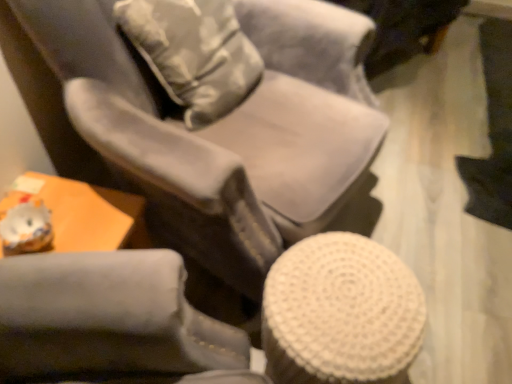
The width and height of the screenshot is (512, 384). What are the coordinates of `suede-like gray chair at center` in the screenshot? It's located at (220, 118).

What is the approximate height of white woven stool at lower right?

white woven stool at lower right is 16.64 inches in height.

In order to face camouflage fabric throw pillow at upper center, should I rotate leftwards or rightwards?

A 7.316 degree turn to the left will do.

This screenshot has height=384, width=512. In order to click on suede-like gray chair at center in this screenshot , I will do [220, 118].

Find the location of a particular element. This screenshot has height=384, width=512. bar stool below the suede-like gray chair at center (from a real-world perspective) is located at coordinates (341, 312).

Looking at this image, would you say white woven stool at lower right is part of suede-like gray chair at center's contents?

No, white woven stool at lower right is not surrounded by suede-like gray chair at center.

Is suede-like gray chair at center taller than white woven stool at lower right?

Indeed, suede-like gray chair at center has a greater height compared to white woven stool at lower right.

Is point (115, 103) positioned in front of point (366, 322)?

No, it is behind (366, 322).

Can you confirm if camouflage fabric throw pillow at upper center is smaller than suede-like gray chair at center?

Indeed, camouflage fabric throw pillow at upper center has a smaller size compared to suede-like gray chair at center.

Is camouflage fabric throw pillow at upper center beside suede-like gray chair at center?

No, camouflage fabric throw pillow at upper center is not next to suede-like gray chair at center.

From the image's perspective, is camouflage fabric throw pillow at upper center on top of suede-like gray chair at center?

Yes.

How different are the orientations of camouflage fabric throw pillow at upper center and suede-like gray chair at center in degrees?

camouflage fabric throw pillow at upper center and suede-like gray chair at center are facing 0.987 degrees away from each other.

Is camouflage fabric throw pillow at upper center spatially inside white woven stool at lower right, or outside of it?

The correct answer is: outside.

Does camouflage fabric throw pillow at upper center have a lesser height compared to white woven stool at lower right?

No.

Can you confirm if camouflage fabric throw pillow at upper center is thinner than white woven stool at lower right?

Correct, the width of camouflage fabric throw pillow at upper center is less than that of white woven stool at lower right.

Considering the relative positions of camouflage fabric throw pillow at upper center and white woven stool at lower right in the image provided, is camouflage fabric throw pillow at upper center to the left or to the right of white woven stool at lower right?

From the image, it's evident that camouflage fabric throw pillow at upper center is to the left of white woven stool at lower right.

Where is `chair lying above the white woven stool at lower right (from the image's perspective)`? chair lying above the white woven stool at lower right (from the image's perspective) is located at coordinates (220, 118).

Is white woven stool at lower right far away from suede-like gray chair at center?

No.

Is white woven stool at lower right taller than suede-like gray chair at center?

Incorrect, the height of white woven stool at lower right is not larger of that of suede-like gray chair at center.

Is point (306, 270) positioned after point (262, 279)?

No, it is in front of (262, 279).

Is white woven stool at lower right facing away from camouflage fabric throw pillow at upper center?

No.

Is white woven stool at lower right in contact with camouflage fabric throw pillow at upper center?

No, white woven stool at lower right is not next to camouflage fabric throw pillow at upper center.

What's the angular difference between white woven stool at lower right and camouflage fabric throw pillow at upper center's facing directions?

The facing directions of white woven stool at lower right and camouflage fabric throw pillow at upper center are 15.9 degrees apart.

Based on the photo, how distant is suede-like gray chair at center from camouflage fabric throw pillow at upper center?

suede-like gray chair at center and camouflage fabric throw pillow at upper center are 4.94 inches apart from each other.

From a real-world perspective, is suede-like gray chair at center located beneath camouflage fabric throw pillow at upper center?

Yes, from a real-world perspective, suede-like gray chair at center is beneath camouflage fabric throw pillow at upper center.

Could camouflage fabric throw pillow at upper center be considered to be inside suede-like gray chair at center?

Yes, camouflage fabric throw pillow at upper center is inside suede-like gray chair at center.

Based on their sizes in the image, would you say suede-like gray chair at center is bigger or smaller than camouflage fabric throw pillow at upper center?

Considering their sizes, suede-like gray chair at center takes up more space than camouflage fabric throw pillow at upper center.

This screenshot has height=384, width=512. What are the coordinates of `bar stool below the suede-like gray chair at center (from a real-world perspective)` in the screenshot? It's located at tap(341, 312).

At what (x,y) coordinates should I click in order to perform the action: click on throw pillow on the left of the suede-like gray chair at center. Please return your answer as a coordinate pair (x, y). Image resolution: width=512 pixels, height=384 pixels. Looking at the image, I should click on (193, 53).

Looking at the image, which one is located further to white woven stool at lower right, suede-like gray chair at center or camouflage fabric throw pillow at upper center?

camouflage fabric throw pillow at upper center.

Looking at the image, which one is located closer to suede-like gray chair at center, white woven stool at lower right or camouflage fabric throw pillow at upper center?

camouflage fabric throw pillow at upper center is closer to suede-like gray chair at center.

When comparing their distances from suede-like gray chair at center, does camouflage fabric throw pillow at upper center or white woven stool at lower right seem further?

Among the two, white woven stool at lower right is located further to suede-like gray chair at center.

Based on their spatial positions, is camouflage fabric throw pillow at upper center or suede-like gray chair at center closer to white woven stool at lower right?

suede-like gray chair at center is positioned closer to the anchor white woven stool at lower right.

When comparing their distances from camouflage fabric throw pillow at upper center, does suede-like gray chair at center or white woven stool at lower right seem closer?

suede-like gray chair at center is closer to camouflage fabric throw pillow at upper center.

When comparing their distances from camouflage fabric throw pillow at upper center, does white woven stool at lower right or suede-like gray chair at center seem further?

The object further to camouflage fabric throw pillow at upper center is white woven stool at lower right.

Where is `chair between camouflage fabric throw pillow at upper center and white woven stool at lower right in the vertical direction`? The image size is (512, 384). chair between camouflage fabric throw pillow at upper center and white woven stool at lower right in the vertical direction is located at coordinates (220, 118).